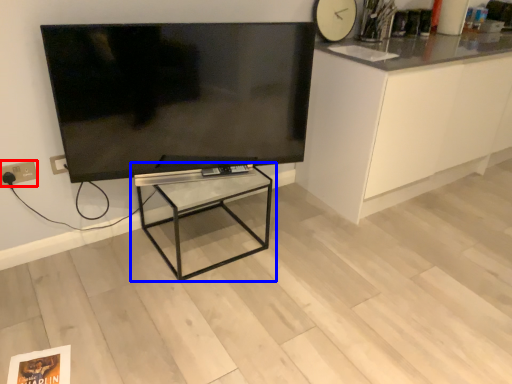
Question: Which point is closer to the camera, electric outlet (highlighted by a red box) or table (highlighted by a blue box)?

Choices:
 (A) electric outlet
 (B) table

Answer: (B)